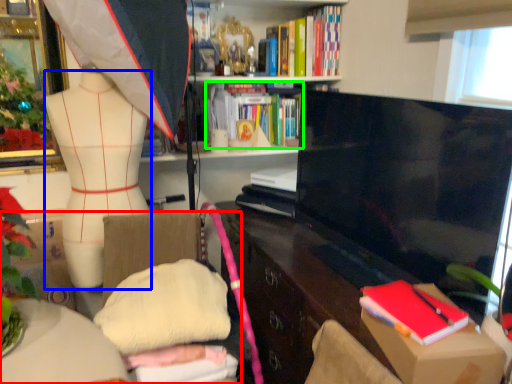
Question: Based on their relative distances, which object is farther from furniture (highlighted by a red box)? Choose from clothing (highlighted by a blue box) and book (highlighted by a green box).

Choices:
 (A) clothing
 (B) book

Answer: (B)